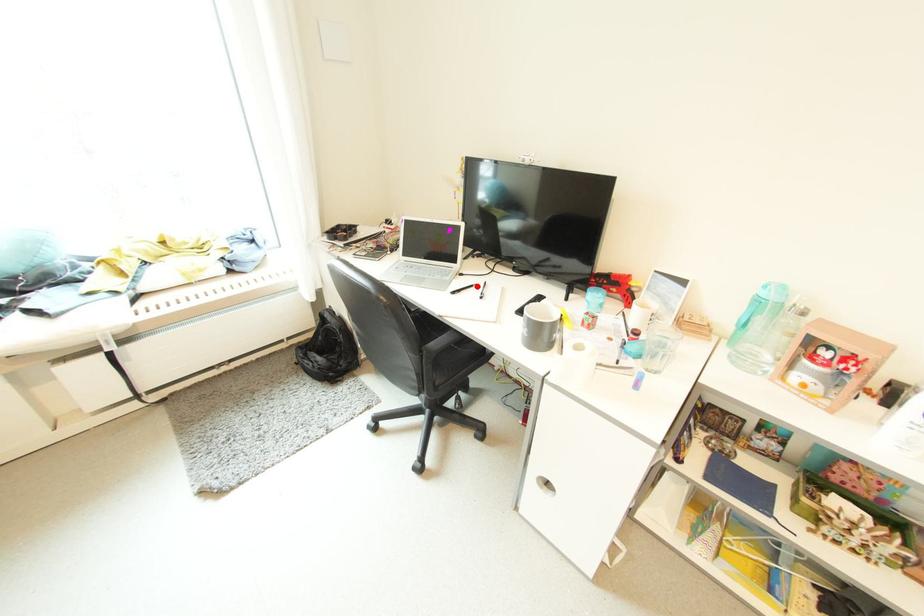
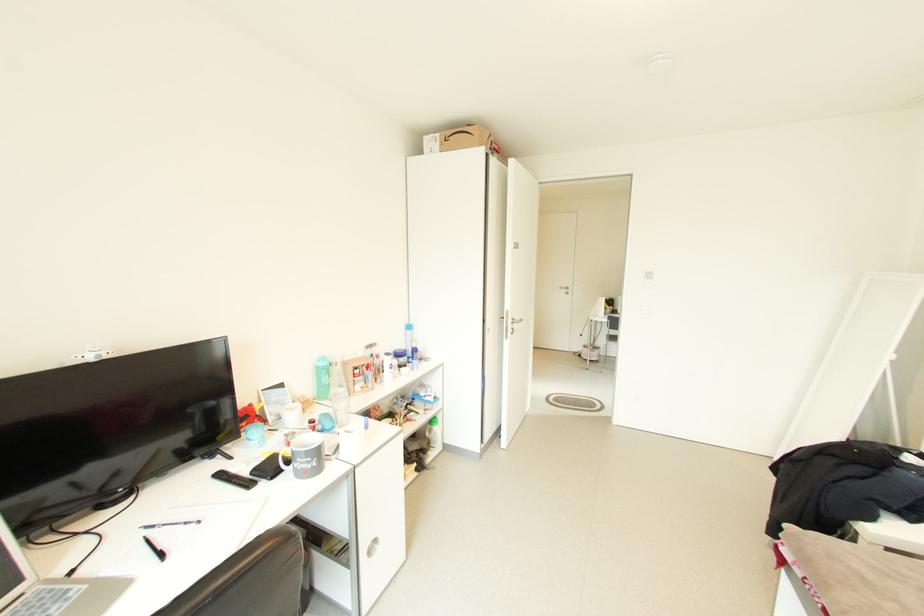
Locate, in the second image, the point that corresponds to the highlighted location in the first image.

(152, 541)